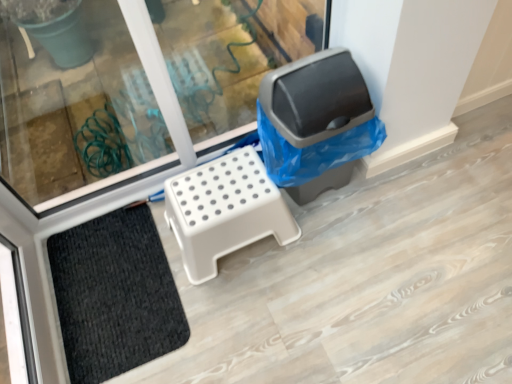
You are a GUI agent. You are given a task and a screenshot of the screen. Output one action in this format:
    pyautogui.click(x=<x>, y=<y>)
    Task: Click on the free space above white plastic step stool at center (from a real-world perspective)
    The height and width of the screenshot is (384, 512).
    Given the screenshot: What is the action you would take?
    pyautogui.click(x=215, y=185)